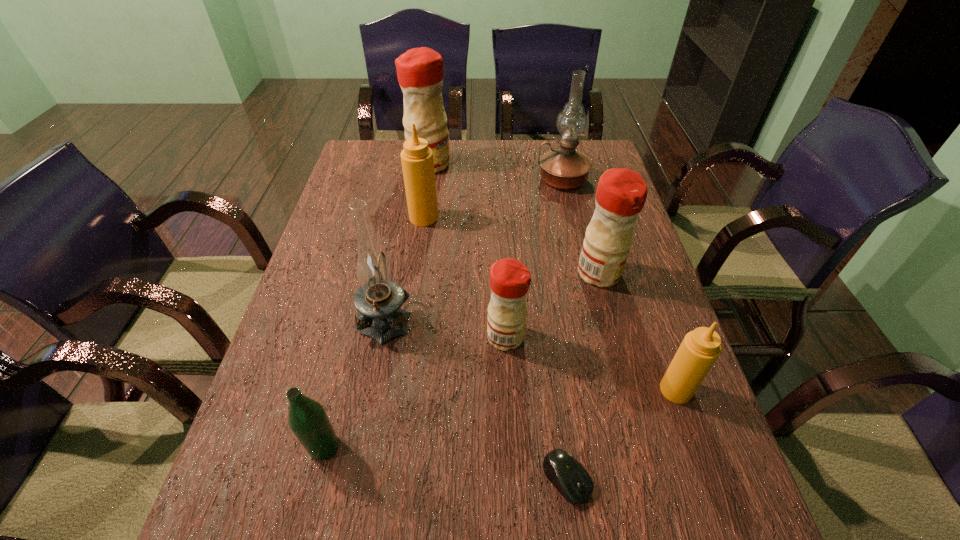
Locate an element on the screen. the tallest condiment is located at coordinates (419, 70).

I want to click on the biggest red condiment, so click(x=419, y=70).

Find the location of a particular element. This screenshot has height=540, width=960. the right oil lamp is located at coordinates (565, 168).

This screenshot has width=960, height=540. In order to click on the left oil lamp in this screenshot , I will do `click(379, 300)`.

Image resolution: width=960 pixels, height=540 pixels. Identify the location of the left tan condiment. (417, 160).

The width and height of the screenshot is (960, 540). Find the location of `the bigger tan condiment`. the bigger tan condiment is located at coordinates (417, 160).

The width and height of the screenshot is (960, 540). Identify the location of the fourth farthest object. (621, 193).

This screenshot has height=540, width=960. I want to click on the second farthest red condiment, so click(x=621, y=193).

Where is `the smaller tan condiment`? The image size is (960, 540). the smaller tan condiment is located at coordinates (699, 350).

The image size is (960, 540). Find the location of `the nearer tan condiment`. the nearer tan condiment is located at coordinates pyautogui.click(x=699, y=350).